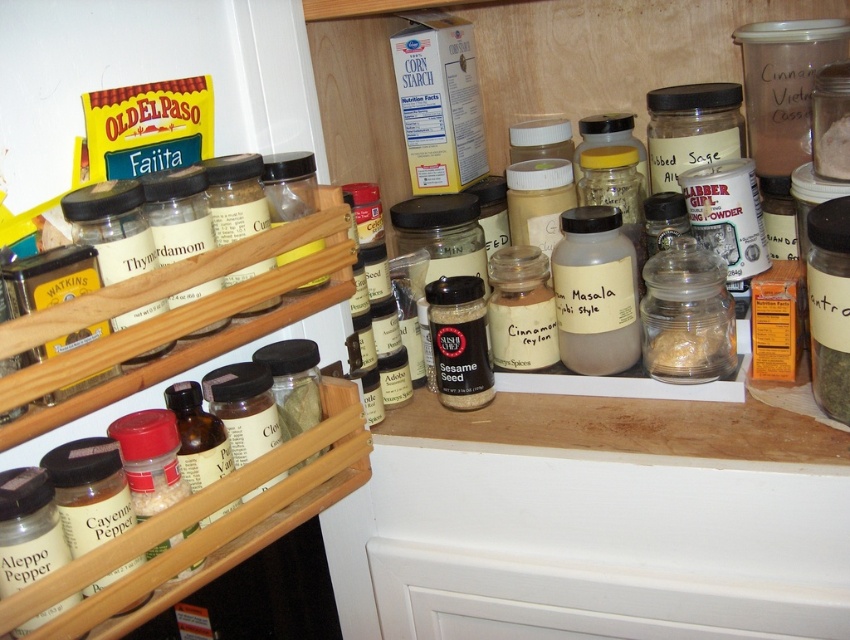
Question: Which point appears closest to the camera in this image?

Choices:
 (A) (706, 44)
 (B) (670, 253)

Answer: (B)

Question: Which point appears farthest from the camera in this image?

Choices:
 (A) click(247, 474)
 (B) click(675, 307)

Answer: (B)

Question: From the image, what is the correct spatial relationship of translucent glass jars at center in relation to clear plastic spice rack at left?

Choices:
 (A) right
 (B) left

Answer: (A)

Question: From the image, what is the correct spatial relationship of clear plastic spice rack at left in relation to translucent glass jar at center-right?

Choices:
 (A) right
 (B) left

Answer: (B)

Question: Which of the following is the closest to the observer?

Choices:
 (A) (320, 102)
 (B) (695, 337)
 (C) (204, 337)

Answer: (C)

Question: Is translucent glass jars at center thinner than clear plastic spice rack at left?

Choices:
 (A) no
 (B) yes

Answer: (A)